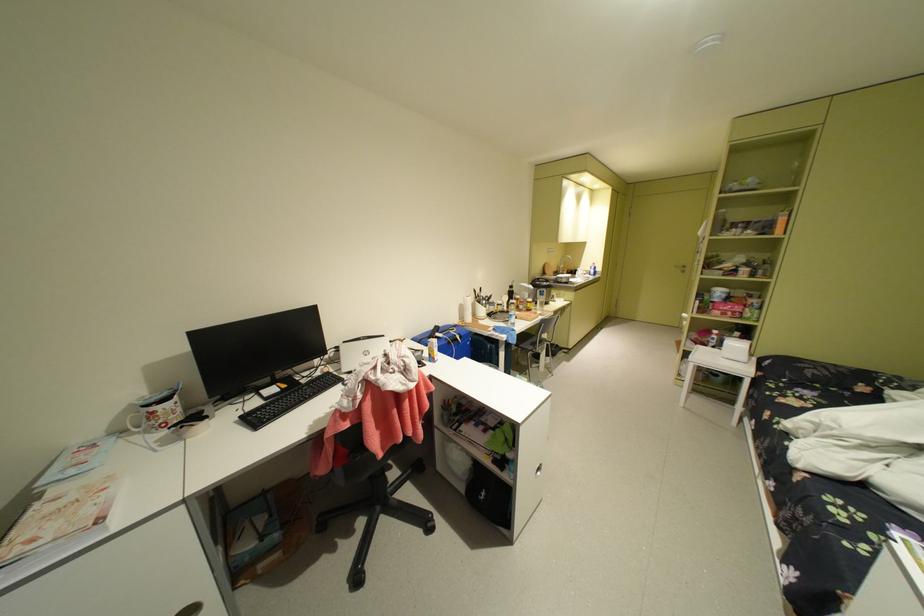
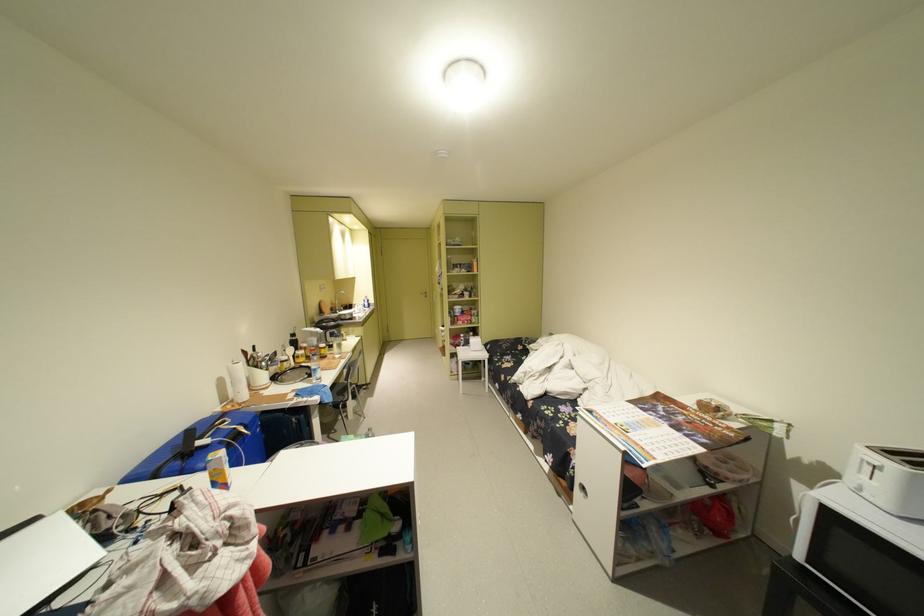
In the second image, find the point that corresponds to point 472,318 in the first image.

(236, 399)